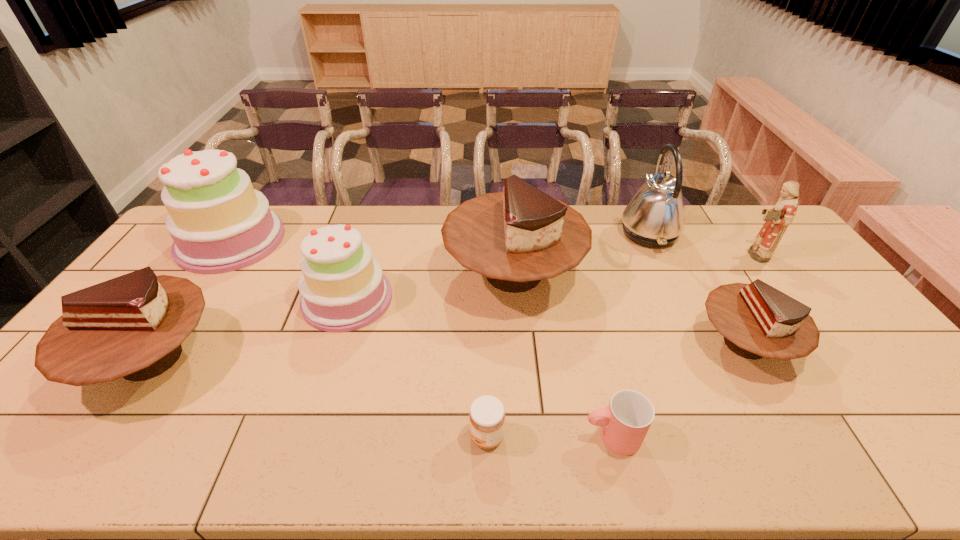
This screenshot has height=540, width=960. I want to click on free space that is in between the cup and the kettle, so click(x=630, y=335).

You are a GUI agent. You are given a task and a screenshot of the screen. Output one action in this format:
    pyautogui.click(x=<x>, y=<y>)
    Task: Click on the unoccupied area between the jam and the right purple cake
    
    Given the screenshot: What is the action you would take?
    pyautogui.click(x=417, y=368)

The height and width of the screenshot is (540, 960). In order to click on empty space that is in between the left purple cake and the cup in this screenshot , I will do `click(421, 339)`.

Locate an element on the screen. The width and height of the screenshot is (960, 540). unoccupied area between the rightmost object and the second cake from right to left is located at coordinates (634, 264).

Locate an element on the screen. Image resolution: width=960 pixels, height=540 pixels. free area in between the bigger purple cake and the orange jam is located at coordinates (359, 339).

Find the location of `free spot between the second smallest red cake and the cup`. free spot between the second smallest red cake and the cup is located at coordinates (382, 397).

The image size is (960, 540). Find the location of `object that is the fourth nearest to the biggest red cake`. object that is the fourth nearest to the biggest red cake is located at coordinates (625, 422).

Identify the location of the eighth closest object relative to the second cake from right to left. Image resolution: width=960 pixels, height=540 pixels. (219, 223).

At what (x,y) coordinates should I click in order to perform the action: click on the closest cake to the leftmost red cake. Please return your answer as a coordinate pair (x, y). Looking at the image, I should click on (343, 289).

At what (x,y) coordinates should I click in order to perform the action: click on the third closest cake relative to the second red cake from left to right. Please return your answer as a coordinate pair (x, y). The width and height of the screenshot is (960, 540). Looking at the image, I should click on (132, 326).